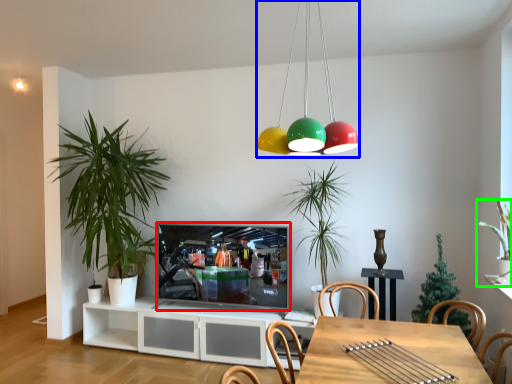
Question: Which object is positioned farthest from television (highlighted by a red box)? Select from chandelier (highlighted by a blue box) and houseplant (highlighted by a green box).

Choices:
 (A) chandelier
 (B) houseplant

Answer: (B)